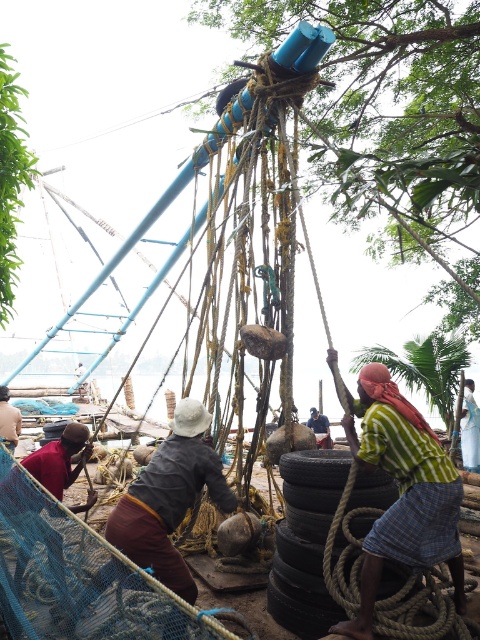
Between striped cotton shirt at center and striped fabric shirt at lower right, which one has more height?

Standing taller between the two is striped cotton shirt at center.

Between striped cotton shirt at center and striped fabric shirt at lower right, which one appears on the left side from the viewer's perspective?

striped cotton shirt at center

Is point (458, 572) farther from camera compared to point (465, 410)?

No.

Find the location of a particular element. striped cotton shirt at center is located at coordinates (404, 493).

Does striped fabric shirt at lower right have a lesser width compared to dark gray fabric at lower left?

No, striped fabric shirt at lower right is not thinner than dark gray fabric at lower left.

Is striped fabric shirt at lower right to the left of dark gray fabric at lower left from the viewer's perspective?

In fact, striped fabric shirt at lower right is to the right of dark gray fabric at lower left.

Which is behind, point (469, 381) or point (12, 444)?

Positioned behind is point (469, 381).

I want to click on striped fabric shirt at lower right, so click(x=469, y=428).

Looking at this image, can you confirm if brown fabric hat at center is thinner than dark blue shirt at center?

Incorrect, brown fabric hat at center's width is not less than dark blue shirt at center's.

Does brown fabric hat at center appear under dark blue shirt at center?

Incorrect, brown fabric hat at center is not positioned below dark blue shirt at center.

The height and width of the screenshot is (640, 480). Find the location of `brown fabric hat at center`. brown fabric hat at center is located at coordinates (169, 499).

This screenshot has width=480, height=640. Identify the location of brown fabric hat at center. (169, 499).